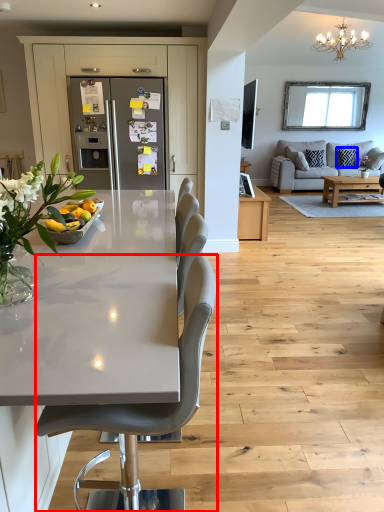
Question: Which object appears farthest to the camera in this image, chair (highlighted by a red box) or pillow (highlighted by a blue box)?

Choices:
 (A) chair
 (B) pillow

Answer: (B)